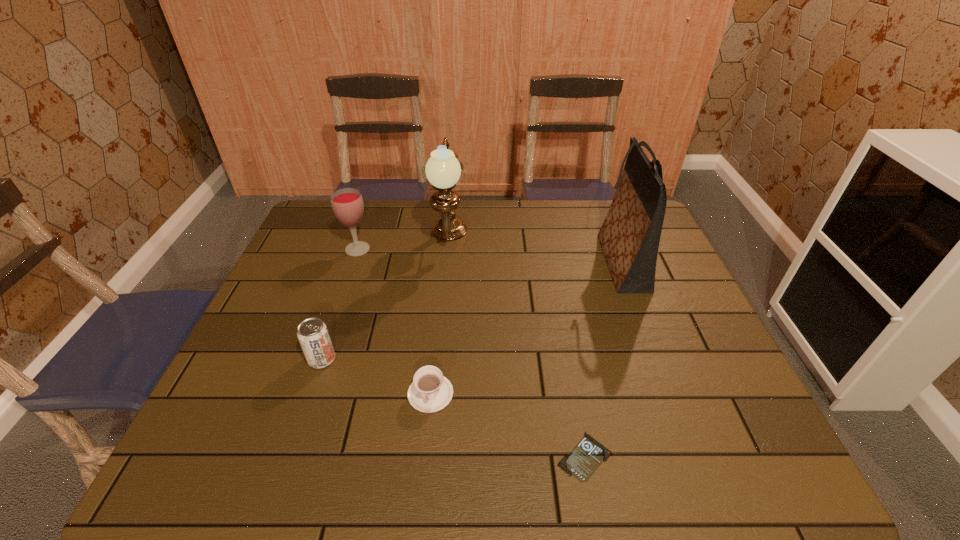
Image resolution: width=960 pixels, height=540 pixels. What are the coordinates of `object at the left edge` in the screenshot? It's located at (347, 204).

Find the location of a particular element. The image size is (960, 540). object present at the right edge is located at coordinates (629, 237).

This screenshot has width=960, height=540. Find the location of `object at the far right corner`. object at the far right corner is located at coordinates [x=629, y=237].

Identify the location of vacant space at the far edge. (560, 207).

Locate an element on the screen. This screenshot has width=960, height=540. free space at the near edge of the desktop is located at coordinates (676, 475).

What are the coordinates of `vacant area at the left edge` in the screenshot? It's located at (273, 353).

In the image, there is a desktop. Where is `vacant space at the right edge`? This screenshot has width=960, height=540. vacant space at the right edge is located at coordinates point(660,315).

I want to click on blank space at the near right corner of the desktop, so coord(765,461).

Locate an element on the screen. This screenshot has height=540, width=960. free space between the wineglass and the shortest object is located at coordinates (471, 353).

Image resolution: width=960 pixels, height=540 pixels. I want to click on free space between the oil lamp and the shopping bag, so click(x=536, y=252).